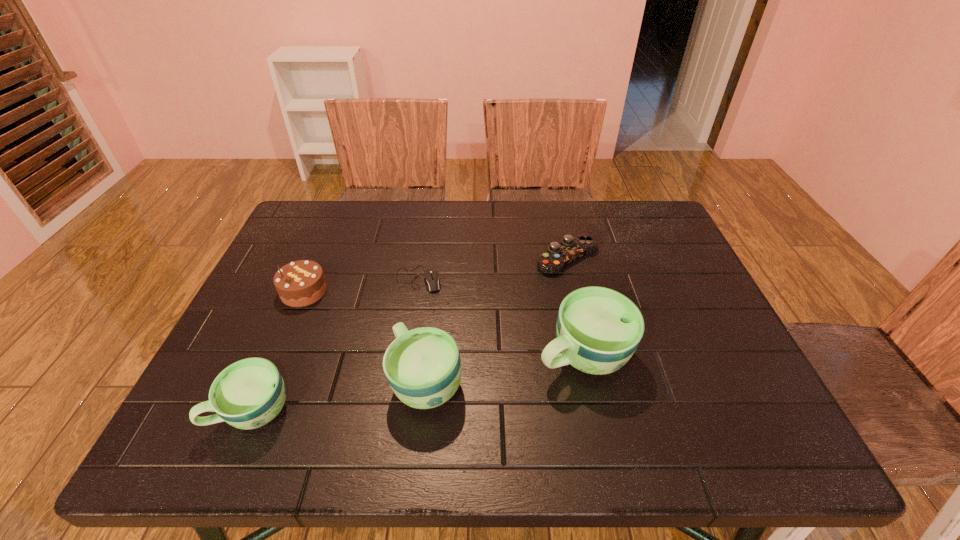
You are a GUI agent. You are given a task and a screenshot of the screen. Output one action in this format:
    pyautogui.click(x=<x>, y=<y>)
    Task: Click on the leftmost cup
    
    Given the screenshot: What is the action you would take?
    pyautogui.click(x=248, y=394)

Where is `the second tallest object`? This screenshot has width=960, height=540. the second tallest object is located at coordinates (423, 367).

Locate an element on the screen. The width and height of the screenshot is (960, 540). the second shortest cup is located at coordinates (423, 367).

You are a GUI agent. You are given a task and a screenshot of the screen. Output one action in this format:
    pyautogui.click(x=<x>, y=<y>)
    Task: Click on the rightmost cup
    
    Given the screenshot: What is the action you would take?
    pyautogui.click(x=598, y=329)

Find the location of a particular element. chocolate cake is located at coordinates (300, 283).

The width and height of the screenshot is (960, 540). I want to click on the shortest object, so click(x=432, y=277).

Locate an element on the screen. This screenshot has height=540, width=960. control is located at coordinates (571, 248).

The width and height of the screenshot is (960, 540). I want to click on vacant space situated 0.340m on the back of the shortest cup, so click(x=311, y=275).

Find the location of a particular element. Image resolution: width=960 pixels, height=540 pixels. free space located 0.310m on the right of the second cup from right to left is located at coordinates (611, 381).

Locate an element on the screen. The image size is (960, 540). vacant space located on the right of the rightmost cup is located at coordinates (671, 355).